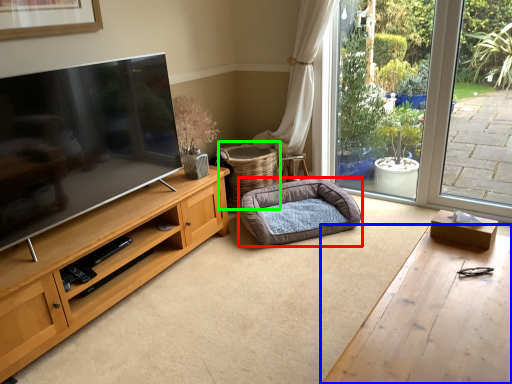
Question: Based on their relative distances, which object is farther from dog bed (highlighted by a red box)? Choose from desk (highlighted by a blue box) and basket (highlighted by a green box).

Choices:
 (A) desk
 (B) basket

Answer: (A)